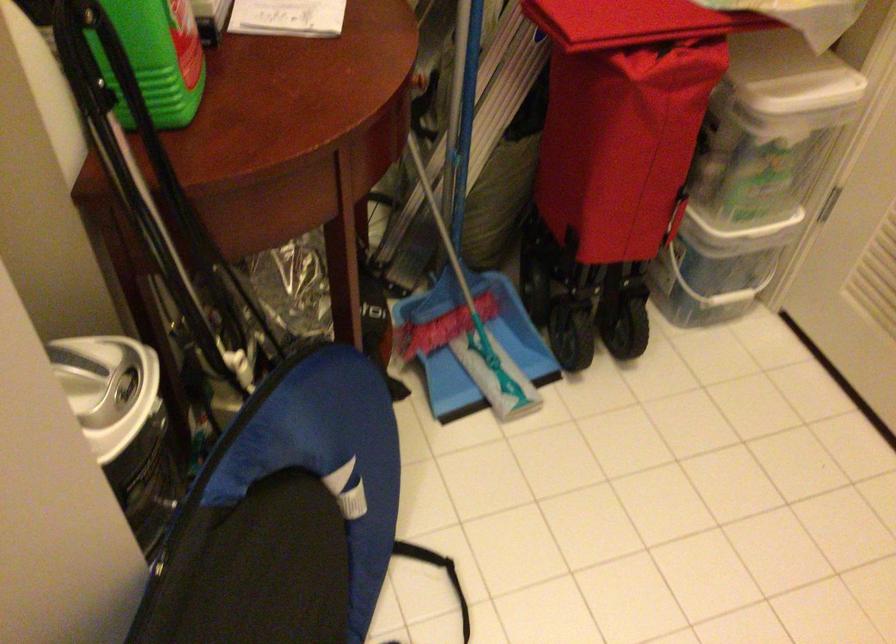
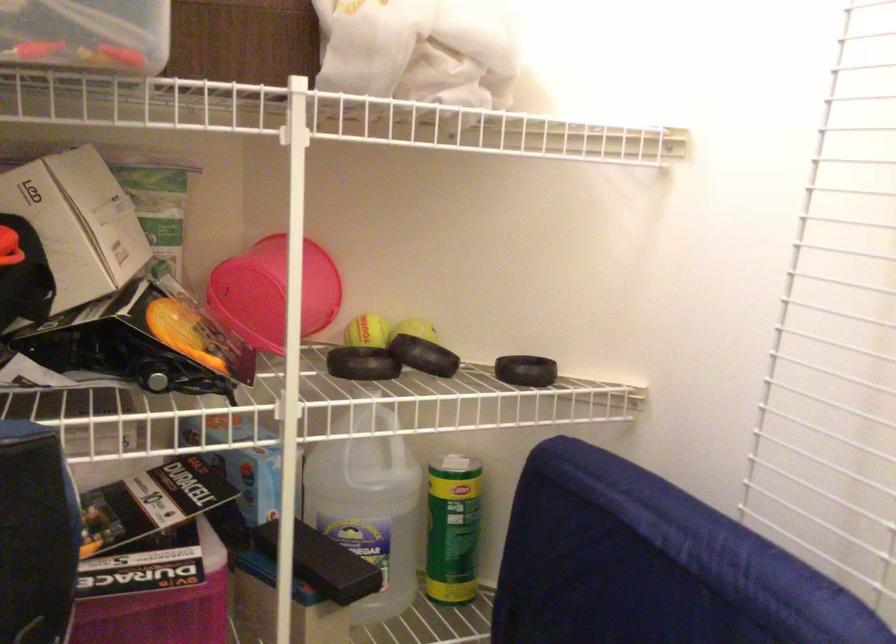
Question: How did the camera likely rotate?

Choices:
 (A) Left
 (B) Right
 (C) Up
 (D) Down

Answer: (A)